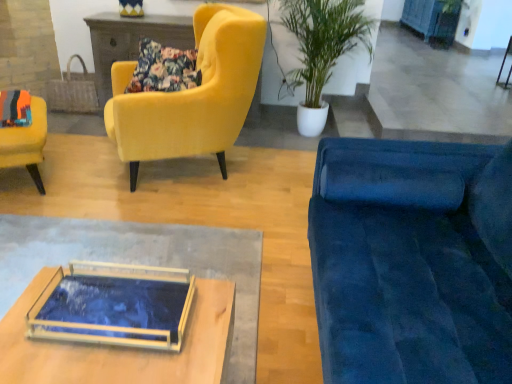
Locate an element on the screen. The image size is (512, 384). unoccupied area in front of woven straw handbag at upper left is located at coordinates point(75,117).